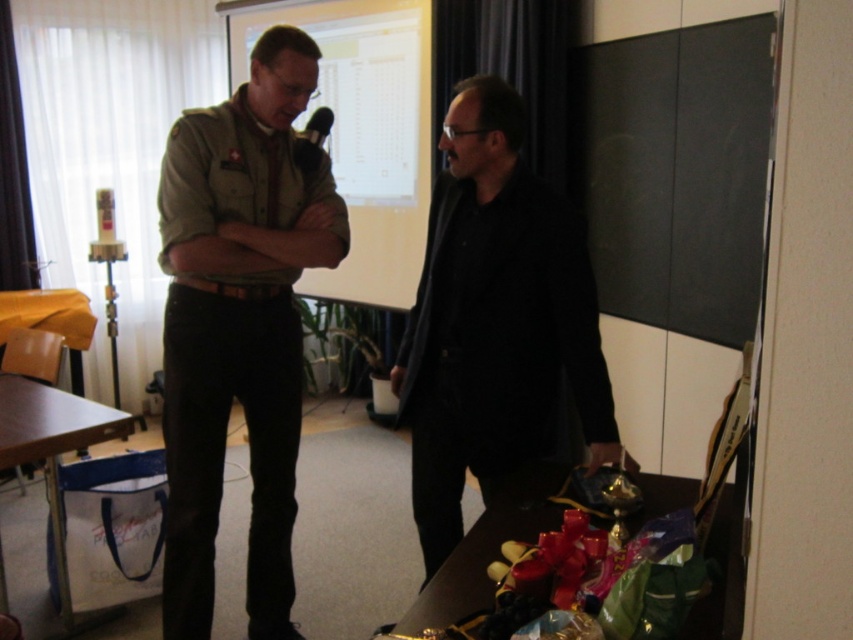
You are organizing a small event and need to place a name tag on the satin khaki shirt at center and the metallic silver microphone at upper center. Since the name tag must be proportional to the object, which object should have a larger name tag?

The satin khaki shirt at center has a larger size compared to the metallic silver microphone at upper center, so the name tag should be larger on the satin khaki shirt at center.

You are organizing a small event and need to place a 1.2 meter long banner between the shiny metallic table at lower right and the light brown wooden table at lower left. Can you fit the banner between them based on their widths?

The shiny metallic table at lower right is wider than the light brown wooden table at lower left. Since the banner is 1.2 meters long, it can only fit if the combined width of both tables is less than 1.2 meters. However, without knowing the exact widths, we cannot confirm if it will fit. Please measure the tables first.

You are standing in the room and want to place a 36 inch long box on the shiny metallic table at lower right. Can you fit it on the table?

The distance of shiny metallic table at lower right from viewer is 39.04 inches, so the 36 inch long box can be placed on it as it is shorter than the table length.